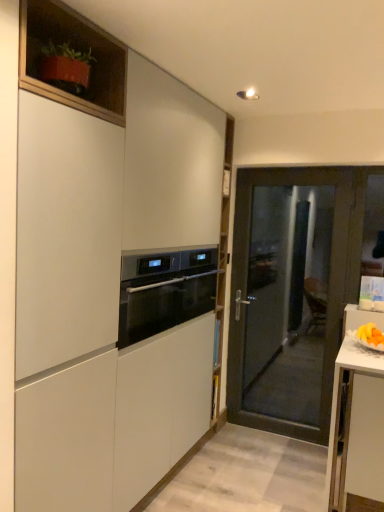
Image resolution: width=384 pixels, height=512 pixels. I want to click on black glass oven at center, so click(164, 291).

In the scene shown: In order to face matte white cabinet at center, which is the 1th cabinetry in front-to-back order, should I rotate leftwards or rightwards?

You should rotate left by 6.616 degrees.

You are a GUI agent. You are given a task and a screenshot of the screen. Output one action in this format:
    pyautogui.click(x=<x>, y=<y>)
    Task: Click on the matte white cabinet at center, which is the 1th cabinetry in front-to-back order
    
    Given the screenshot: What is the action you would take?
    pyautogui.click(x=108, y=292)

Locate an element on the screen. The image size is (384, 512). transparent glass door at center is located at coordinates (291, 293).

In order to click on black glass oven at center in this screenshot , I will do `click(164, 291)`.

Is black glass oven at center inside matte wood cabinet at upper left, which appears as the first cabinetry when viewed from the top?

Actually, black glass oven at center is outside matte wood cabinet at upper left, which appears as the first cabinetry when viewed from the top.

Can you confirm if matte wood cabinet at upper left, which appears as the first cabinetry when viewed from the back, is wider than black glass oven at center?

Incorrect, the width of matte wood cabinet at upper left, which appears as the first cabinetry when viewed from the back, does not surpass that of black glass oven at center.

Would you consider matte wood cabinet at upper left, which appears as the first cabinetry when viewed from the back, to be distant from black glass oven at center?

No.

Is black glass oven at center shorter than matte wood cabinet at upper left, which appears as the first cabinetry when viewed from the back?

In fact, black glass oven at center may be taller than matte wood cabinet at upper left, which appears as the first cabinetry when viewed from the back.

From a real-world perspective, which is physically above, black glass oven at center or matte wood cabinet at upper left, which appears as the first cabinetry when viewed from the back?

matte wood cabinet at upper left, which appears as the first cabinetry when viewed from the back, from a real-world perspective.

Looking at this image, visually, is matte white cabinet at center, the second cabinetry when ordered from top to bottom, positioned to the left or to the right of matte wood cabinet at upper left, the second cabinetry ordered from the bottom?

matte white cabinet at center, the second cabinetry when ordered from top to bottom, is positioned on matte wood cabinet at upper left, the second cabinetry ordered from the bottom,'s right side.

Can you confirm if matte white cabinet at center, which is the 1th cabinetry in front-to-back order, is taller than matte wood cabinet at upper left, which appears as the first cabinetry when viewed from the back?

A: Correct, matte white cabinet at center, which is the 1th cabinetry in front-to-back order, is much taller as matte wood cabinet at upper left, which appears as the first cabinetry when viewed from the back.

From the image's perspective, between matte white cabinet at center, the 1th cabinetry ordered from the bottom, and matte wood cabinet at upper left, the 2th cabinetry viewed from the front, who is located below?

matte white cabinet at center, the 1th cabinetry ordered from the bottom, from the image's perspective.

Is point (79, 271) less distant than point (98, 56)?

Yes, point (79, 271) is closer to viewer.

Visually, is matte white cabinet at center, the second cabinetry when ordered from top to bottom, positioned to the left or to the right of black glass oven at center?

matte white cabinet at center, the second cabinetry when ordered from top to bottom, is positioned on black glass oven at center's left side.

Between point (121, 490) and point (171, 281), which one is positioned in front?

The point (121, 490) is closer to the camera.

In the scene shown: Which of these two, matte white cabinet at center, the 1th cabinetry ordered from the bottom, or black glass oven at center, is smaller?

Smaller between the two is black glass oven at center.

Would you say matte white cabinet at center, acting as the 2th cabinetry starting from the back, is inside or outside black glass oven at center?

matte white cabinet at center, acting as the 2th cabinetry starting from the back, exists outside the volume of black glass oven at center.

Is transparent glass door at center positioned beyond the bounds of matte wood cabinet at upper left, the second cabinetry ordered from the bottom?

transparent glass door at center is positioned outside matte wood cabinet at upper left, the second cabinetry ordered from the bottom.

Looking at this image, from the image's perspective, is transparent glass door at center above matte wood cabinet at upper left, which appears as the first cabinetry when viewed from the back?

No, from the image's perspective, transparent glass door at center is not above matte wood cabinet at upper left, which appears as the first cabinetry when viewed from the back.

Measure the distance between transparent glass door at center and matte wood cabinet at upper left, which appears as the first cabinetry when viewed from the top.

The distance of transparent glass door at center from matte wood cabinet at upper left, which appears as the first cabinetry when viewed from the top, is 2.00 meters.

Is transparent glass door at center positioned in front of black glass oven at center?

No.

Could black glass oven at center be considered to be inside transparent glass door at center?

Actually, black glass oven at center is outside transparent glass door at center.

From a real-world perspective, is transparent glass door at center located beneath black glass oven at center?

Yes, from a real-world perspective, transparent glass door at center is under black glass oven at center.

Where is `kitchen appliance in front of the transparent glass door at center`? Image resolution: width=384 pixels, height=512 pixels. kitchen appliance in front of the transparent glass door at center is located at coordinates (164, 291).

Who is smaller, matte wood cabinet at upper left, which appears as the first cabinetry when viewed from the back, or matte white cabinet at center, which is the 1th cabinetry in front-to-back order?

With smaller size is matte wood cabinet at upper left, which appears as the first cabinetry when viewed from the back.

From a real-world perspective, which is physically below, matte wood cabinet at upper left, the second cabinetry ordered from the bottom, or matte white cabinet at center, which is the 1th cabinetry in front-to-back order?

matte white cabinet at center, which is the 1th cabinetry in front-to-back order.

Could you tell me if matte wood cabinet at upper left, the second cabinetry ordered from the bottom, is facing matte white cabinet at center, acting as the 2th cabinetry starting from the back?

Yes, matte wood cabinet at upper left, the second cabinetry ordered from the bottom, faces towards matte white cabinet at center, acting as the 2th cabinetry starting from the back.

Is matte wood cabinet at upper left, which appears as the first cabinetry when viewed from the top, inside the boundaries of matte white cabinet at center, acting as the 2th cabinetry starting from the back, or outside?

The correct answer is: inside.

Starting from the black glass oven at center, which cabinetry is the 2nd one to the left? Please provide its 2D coordinates.

[(71, 60)]

The height and width of the screenshot is (512, 384). In order to click on cabinetry above the black glass oven at center (from a real-world perspective) in this screenshot , I will do `click(71, 60)`.

Looking at this image, estimate the real-world distances between objects in this image. Which object is further from matte white cabinet at center, the 1th cabinetry ordered from the bottom, black glass oven at center or transparent glass door at center?

transparent glass door at center lies further to matte white cabinet at center, the 1th cabinetry ordered from the bottom, than the other object.

From the image, which object appears to be farther from matte white cabinet at center, which is the 1th cabinetry in front-to-back order, matte wood cabinet at upper left, which appears as the first cabinetry when viewed from the back, or transparent glass door at center?

transparent glass door at center lies further to matte white cabinet at center, which is the 1th cabinetry in front-to-back order, than the other object.

Which object lies nearer to the anchor point black glass oven at center, transparent glass door at center or matte wood cabinet at upper left, which appears as the first cabinetry when viewed from the top?

Based on the image, matte wood cabinet at upper left, which appears as the first cabinetry when viewed from the top, appears to be nearer to black glass oven at center.

When comparing their distances from matte wood cabinet at upper left, which appears as the first cabinetry when viewed from the back, does matte white cabinet at center, the second cabinetry when ordered from top to bottom, or transparent glass door at center seem closer?

matte white cabinet at center, the second cabinetry when ordered from top to bottom, is closer to matte wood cabinet at upper left, which appears as the first cabinetry when viewed from the back.

Looking at the image, which one is located closer to matte wood cabinet at upper left, which appears as the first cabinetry when viewed from the top, transparent glass door at center or matte white cabinet at center, the second cabinetry when ordered from top to bottom?

matte white cabinet at center, the second cabinetry when ordered from top to bottom.

Looking at the image, which one is located closer to matte wood cabinet at upper left, which appears as the first cabinetry when viewed from the top, matte white cabinet at center, acting as the 2th cabinetry starting from the back, or black glass oven at center?

Among the two, matte white cabinet at center, acting as the 2th cabinetry starting from the back, is located nearer to matte wood cabinet at upper left, which appears as the first cabinetry when viewed from the top.

Considering their positions, is matte white cabinet at center, acting as the 2th cabinetry starting from the back, positioned closer to transparent glass door at center than matte wood cabinet at upper left, which appears as the first cabinetry when viewed from the back?

matte white cabinet at center, acting as the 2th cabinetry starting from the back, lies closer to transparent glass door at center than the other object.

Based on their spatial positions, is transparent glass door at center or matte wood cabinet at upper left, which appears as the first cabinetry when viewed from the back, further from matte white cabinet at center, acting as the 2th cabinetry starting from the back?

transparent glass door at center is further to matte white cabinet at center, acting as the 2th cabinetry starting from the back.

Where is `kitchen appliance positioned between matte wood cabinet at upper left, which appears as the first cabinetry when viewed from the back, and transparent glass door at center from near to far`? kitchen appliance positioned between matte wood cabinet at upper left, which appears as the first cabinetry when viewed from the back, and transparent glass door at center from near to far is located at coordinates (164, 291).

The height and width of the screenshot is (512, 384). In order to click on cabinetry between matte white cabinet at center, the 1th cabinetry ordered from the bottom, and black glass oven at center, along the z-axis in this screenshot , I will do `click(71, 60)`.

The image size is (384, 512). I want to click on kitchen appliance between matte white cabinet at center, the 1th cabinetry ordered from the bottom, and transparent glass door at center, along the z-axis, so click(164, 291).

Identify the location of cabinetry between matte white cabinet at center, the 1th cabinetry ordered from the bottom, and transparent glass door at center, along the z-axis. This screenshot has width=384, height=512. (71, 60).